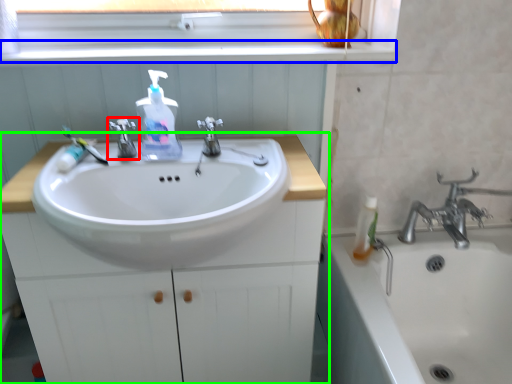
Question: Which object is the farthest from tap (highlighted by a red box)? Choose among these: window sill (highlighted by a blue box) or bathroom cabinet (highlighted by a green box).

Choices:
 (A) window sill
 (B) bathroom cabinet

Answer: (B)